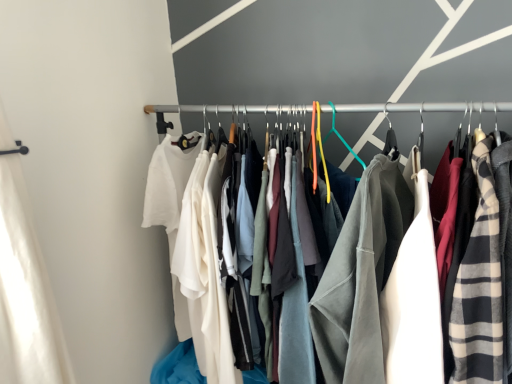
Question: Should I look upward or downward to see textured cotton shirts at center?

Choices:
 (A) up
 (B) down

Answer: (B)